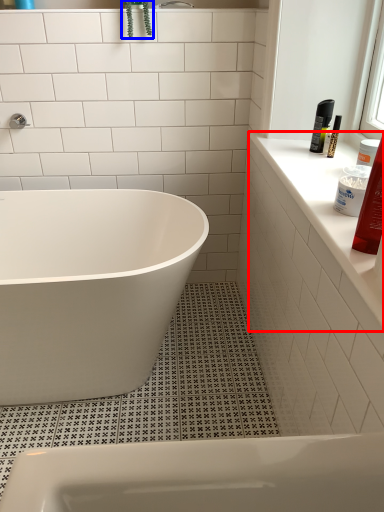
Question: Among these objects, which one is farthest to the camera, window sill (highlighted by a red box) or plant (highlighted by a blue box)?

Choices:
 (A) window sill
 (B) plant

Answer: (B)